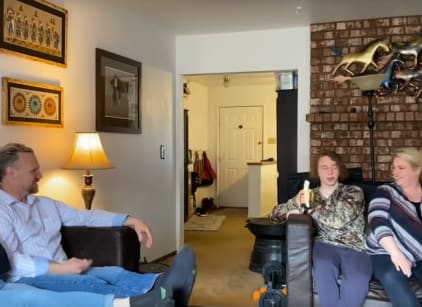
This screenshot has height=307, width=422. In order to click on lamp in this screenshot , I will do `click(371, 81)`.